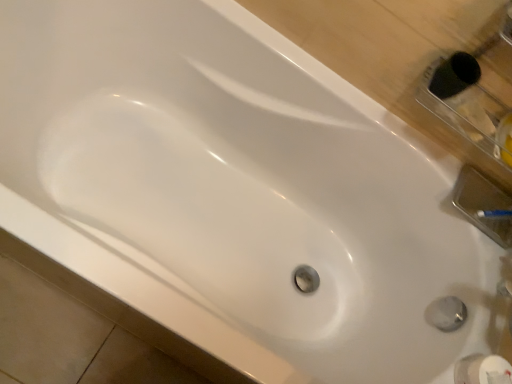
The image size is (512, 384). What do you see at coordinates (482, 370) in the screenshot?
I see `white matte toilet paper at lower right` at bounding box center [482, 370].

Identify the location of white matte toilet paper at lower right. This screenshot has width=512, height=384. (482, 370).

Locate an element on the screen. white matte toilet paper at lower right is located at coordinates coord(482,370).